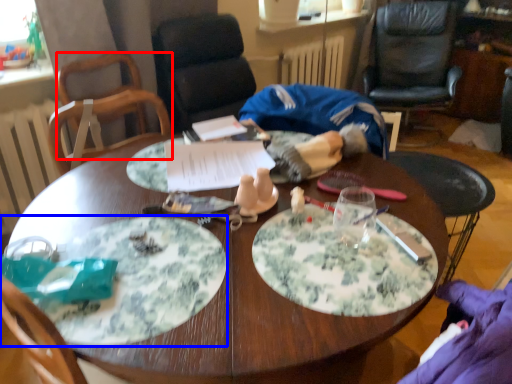
Question: Which of the following is the farthest to the observer, chair (highlighted by a red box) or plate (highlighted by a blue box)?

Choices:
 (A) chair
 (B) plate

Answer: (A)